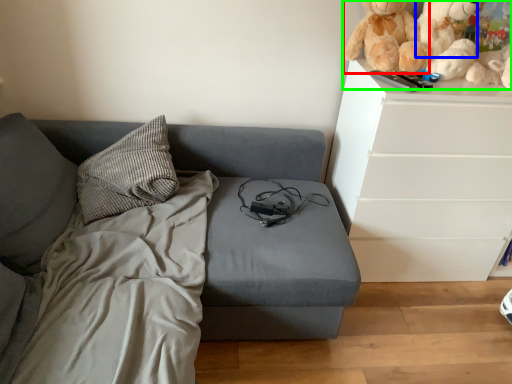
Question: Estimate the real-world distances between objects in this image. Which object is closer to doll (highlighted by a red box), teddy (highlighted by a blue box) or toy (highlighted by a green box)?

Choices:
 (A) teddy
 (B) toy

Answer: (B)